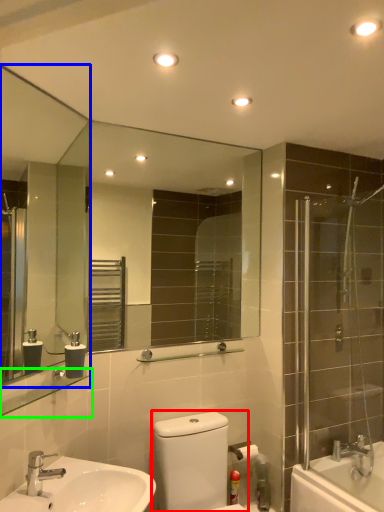
Question: Which object is positioned closest to gray (highlighted by a red box)? Select from mirror (highlighted by a blue box) and balustrade (highlighted by a green box).

Choices:
 (A) mirror
 (B) balustrade

Answer: (B)